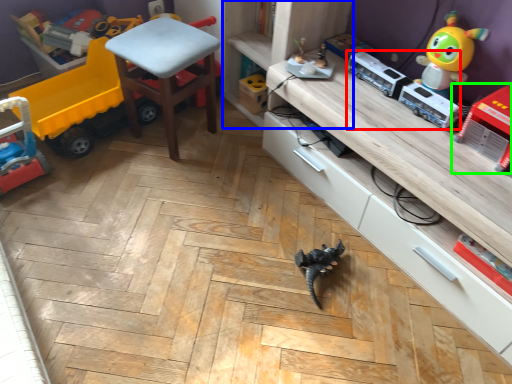
Question: Which object is positioned farthest from equipment (highlighted by a red box)? Select from shelf (highlighted by a blue box) and toy (highlighted by a green box).

Choices:
 (A) shelf
 (B) toy

Answer: (A)